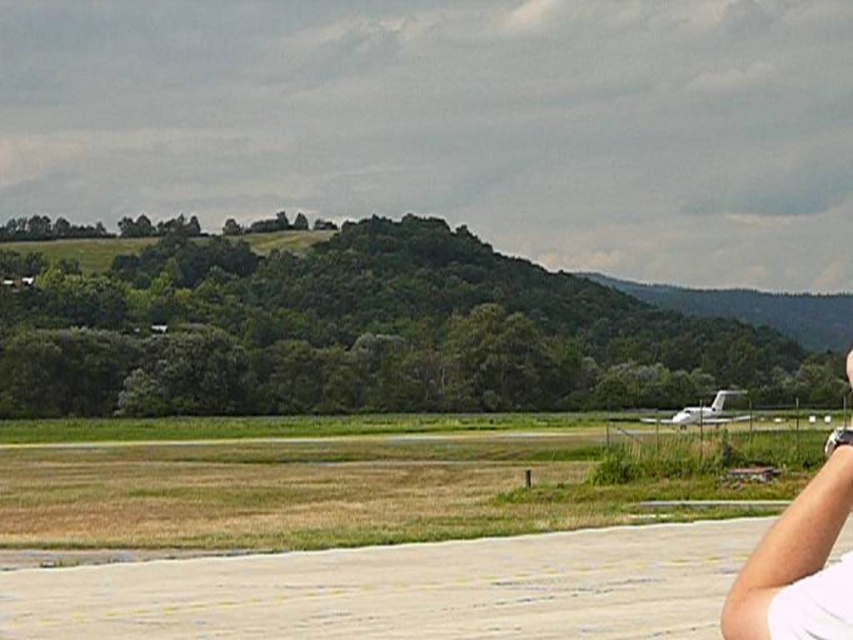
Question: Which of these objects is positioned closest to the white glossy airplane at lower right?

Choices:
 (A) white smooth tarmac at lower center
 (B) white fabric at lower right

Answer: (A)

Question: Does white smooth tarmac at lower center appear under white fabric at lower right?

Choices:
 (A) no
 (B) yes

Answer: (B)

Question: Estimate the real-world distances between objects in this image. Which object is closer to the white glossy airplane at lower right?

Choices:
 (A) white fabric at lower right
 (B) white smooth tarmac at lower center

Answer: (B)

Question: Is white smooth tarmac at lower center further to camera compared to white glossy airplane at lower right?

Choices:
 (A) yes
 (B) no

Answer: (B)

Question: Which is nearer to the white glossy airplane at lower right?

Choices:
 (A) white fabric at lower right
 (B) white smooth tarmac at lower center

Answer: (B)

Question: Does white smooth tarmac at lower center have a greater width compared to white fabric at lower right?

Choices:
 (A) no
 (B) yes

Answer: (B)